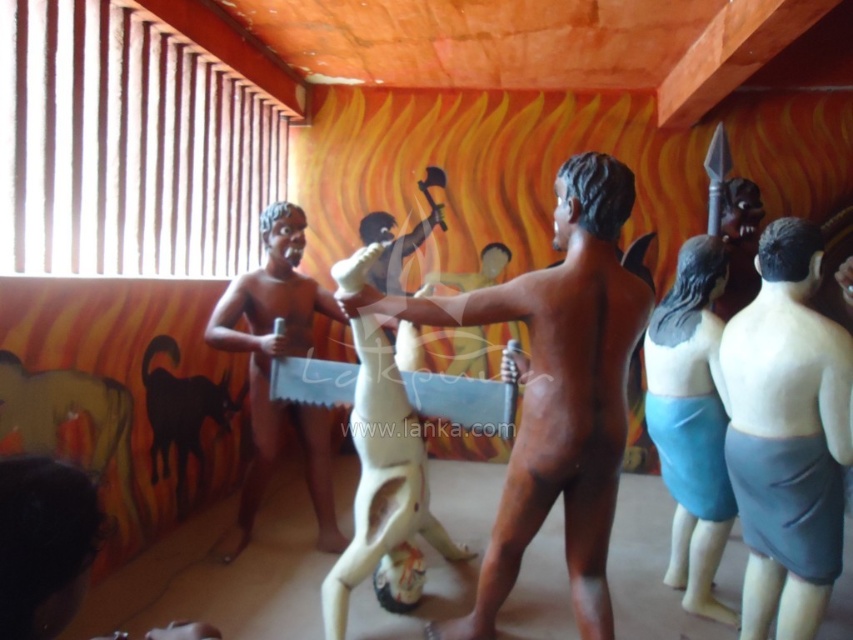
You are an art curator planning to display the gray matte skirt at center and the blue fabric skirt at center in a new exhibition. Given their spatial dimensions, which skirt should be placed in a more prominent position to ensure visibility?

The blue fabric skirt at center should be placed in a more prominent position because it occupies more space than the gray matte skirt at center, making it more noticeable and suitable for emphasis in the exhibition layout.

Based on the scene description, which object is wider, the brown matte statue at center or the gray matte skirt at center?

The brown matte statue at center is wider than the gray matte skirt at center according to the description.